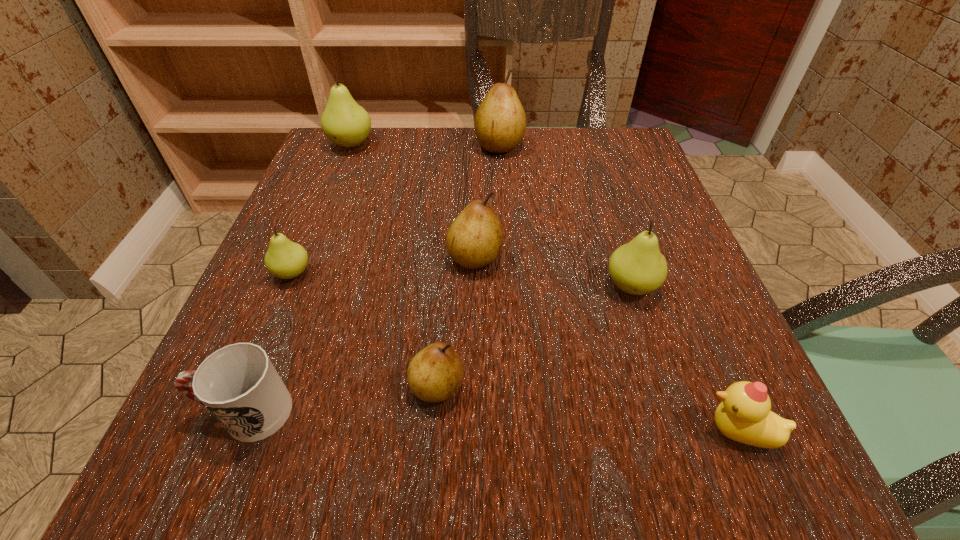
I want to click on vacant space situated 0.180m on the front of the farthest brown pear, so click(x=503, y=208).

Find the location of a particular element. The height and width of the screenshot is (540, 960). free space located 0.250m on the front of the biggest green pear is located at coordinates (319, 227).

The height and width of the screenshot is (540, 960). Identify the location of free space located on the front of the second nearest brown pear. (474, 300).

Where is `vacant area located 0.080m on the right of the rightmost pear`? The height and width of the screenshot is (540, 960). vacant area located 0.080m on the right of the rightmost pear is located at coordinates (707, 286).

At what (x,y) coordinates should I click in order to perform the action: click on free space located on the right of the smallest green pear. Please return your answer as a coordinate pair (x, y). The image size is (960, 540). Looking at the image, I should click on (513, 273).

I want to click on free space located on the back of the smallest brown pear, so click(x=450, y=214).

Where is `vacant space located on the front-facing side of the duckling`? The width and height of the screenshot is (960, 540). vacant space located on the front-facing side of the duckling is located at coordinates (614, 431).

Where is `free spot located on the front-facing side of the duckling`? free spot located on the front-facing side of the duckling is located at coordinates (590, 431).

At what (x,y) coordinates should I click in order to perform the action: click on vacant space located 0.190m on the front-facing side of the duckling. Please return your answer as a coordinate pair (x, y). The height and width of the screenshot is (540, 960). Looking at the image, I should click on (551, 431).

Locate an element on the screen. This screenshot has height=540, width=960. duckling located in the near edge section of the desktop is located at coordinates (744, 415).